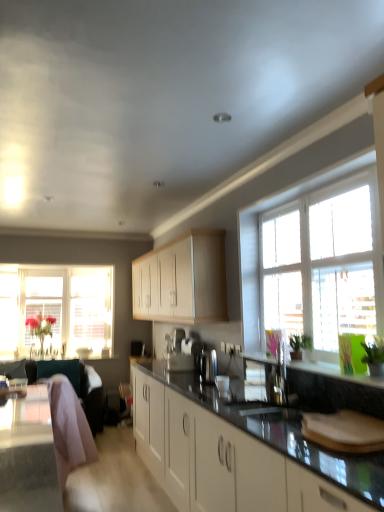
Question: Is light wood cabinet at center facing towards pink fabric swivel chair at lower left, acting as the 2th swivel chair starting from the front?

Choices:
 (A) yes
 (B) no

Answer: (B)

Question: From the image's perspective, is light wood cabinet at center located above pink fabric swivel chair at lower left, acting as the 2th swivel chair starting from the front?

Choices:
 (A) yes
 (B) no

Answer: (A)

Question: Can you confirm if light wood cabinet at center is thinner than pink fabric swivel chair at lower left, positioned as the 1th swivel chair in back-to-front order?

Choices:
 (A) no
 (B) yes

Answer: (B)

Question: Is light wood cabinet at center facing away from pink fabric swivel chair at lower left, acting as the 2th swivel chair starting from the front?

Choices:
 (A) yes
 (B) no

Answer: (B)

Question: Can you confirm if light wood cabinet at center is positioned to the left of pink fabric swivel chair at lower left, positioned as the 1th swivel chair in back-to-front order?

Choices:
 (A) yes
 (B) no

Answer: (B)

Question: Looking at the image, does satin silver coffee machine at center seem bigger or smaller compared to pink fabric swivel chair at lower left, the first swivel chair when ordered from front to back?

Choices:
 (A) big
 (B) small

Answer: (B)

Question: Looking at their shapes, would you say satin silver coffee machine at center is wider or thinner than pink fabric swivel chair at lower left, arranged as the second swivel chair when viewed from the back?

Choices:
 (A) thin
 (B) wide

Answer: (A)

Question: From a real-world perspective, is satin silver coffee machine at center positioned above or below pink fabric swivel chair at lower left, arranged as the second swivel chair when viewed from the back?

Choices:
 (A) above
 (B) below

Answer: (A)

Question: Considering the positions of point (205, 375) and point (77, 418), is point (205, 375) closer or farther from the camera than point (77, 418)?

Choices:
 (A) farther
 (B) closer

Answer: (A)

Question: Is black glossy countertop at center to the left or to the right of clear glass window at right, which ranks as the first window in right-to-left order, in the image?

Choices:
 (A) left
 (B) right

Answer: (A)

Question: Considering their positions, is black glossy countertop at center located in front of or behind clear glass window at right, acting as the second window starting from the left?

Choices:
 (A) behind
 (B) front

Answer: (B)

Question: Do you think black glossy countertop at center is within clear glass window at right, which ranks as the first window in right-to-left order, or outside of it?

Choices:
 (A) outside
 (B) inside

Answer: (A)

Question: From a real-world perspective, is black glossy countertop at center above or below clear glass window at right, the 1th window from the front?

Choices:
 (A) below
 (B) above

Answer: (A)

Question: From the image's perspective, is black glossy countertop at center above or below pink fabric swivel chair at lower left, arranged as the second swivel chair when viewed from the back?

Choices:
 (A) below
 (B) above

Answer: (B)

Question: From a real-world perspective, is black glossy countertop at center positioned above or below pink fabric swivel chair at lower left, arranged as the second swivel chair when viewed from the back?

Choices:
 (A) above
 (B) below

Answer: (B)